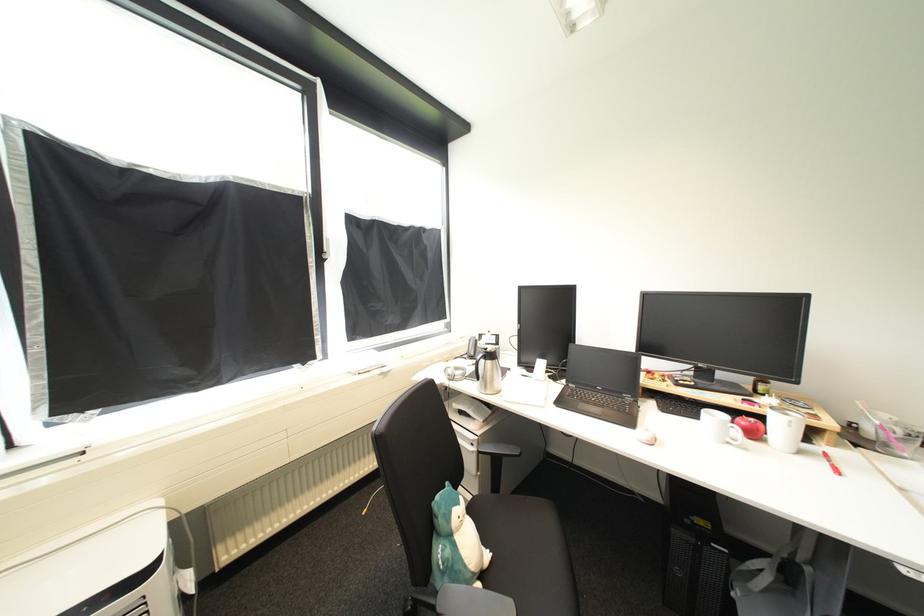
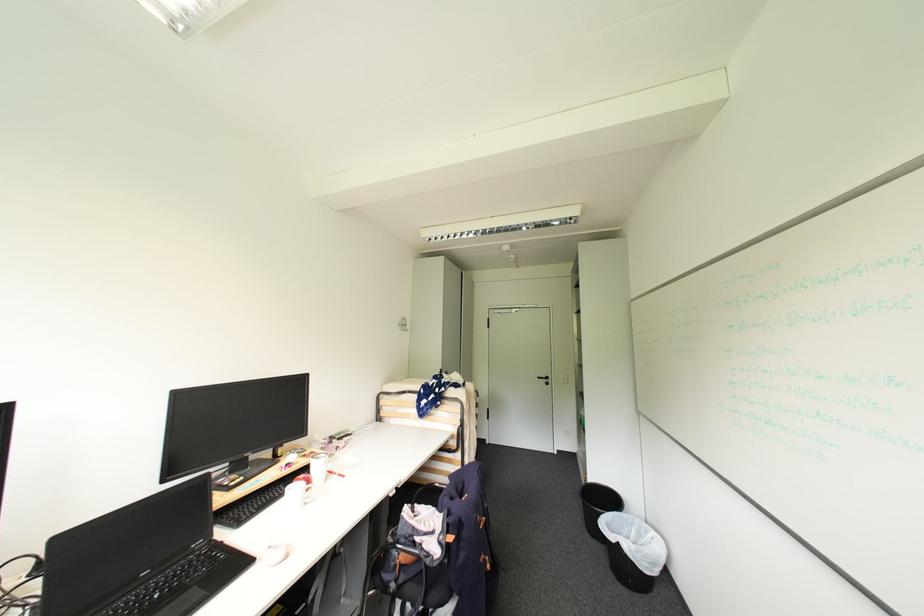
The point at (834, 464) is marked in the first image. Where is the corresponding point in the second image?

(343, 477)